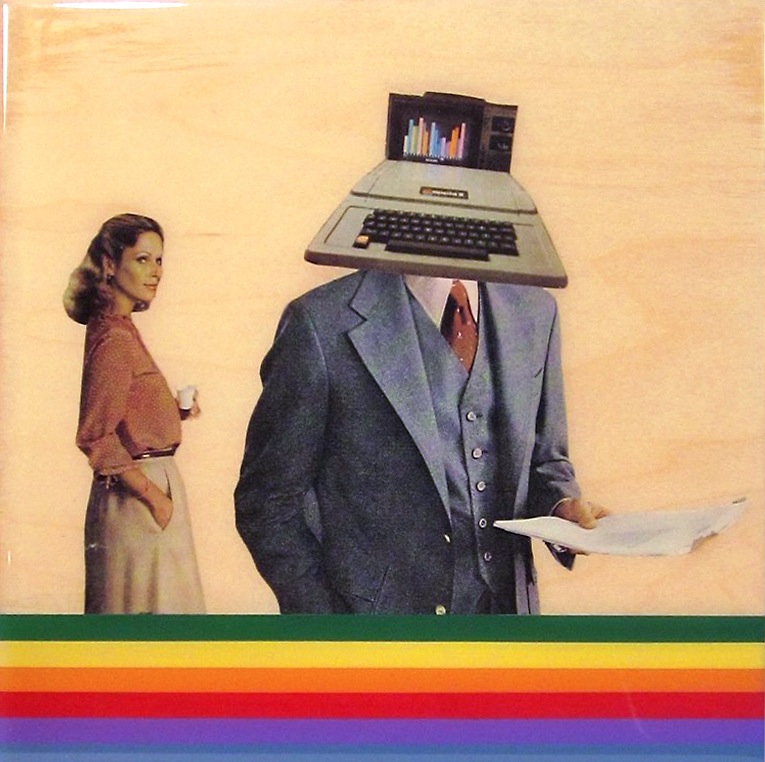
Find the location of a particular element. screen is located at coordinates (451, 130).